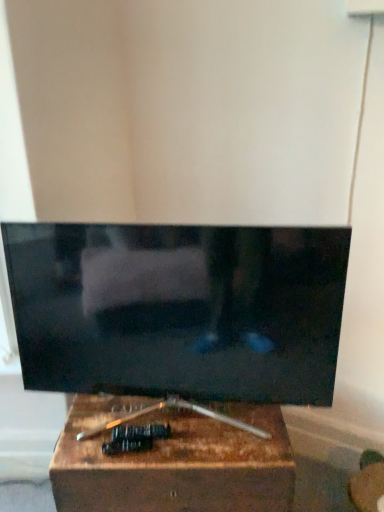
The image size is (384, 512). I want to click on free region under matte black tv at center (from a real-world perspective), so click(x=171, y=419).